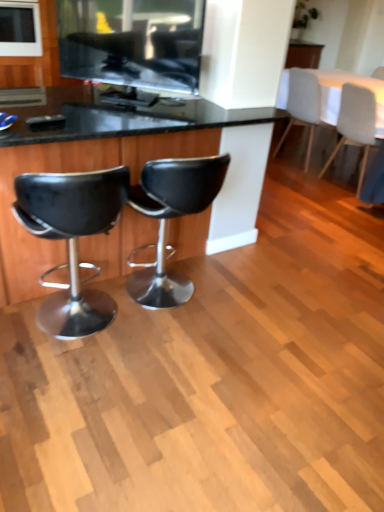
At what (x,y) coordinates should I click in order to perform the action: click on white fabric chair at upper right, the second chair positioned from the back. Please return your answer as a coordinate pair (x, y). Looking at the image, I should click on (356, 124).

Describe the element at coordinates (356, 124) in the screenshot. I see `white fabric chair at upper right, the second chair positioned from the back` at that location.

In order to face black leather desk at center, should I rotate leftwards or rightwards?

Rotate left and turn 12.458 degrees.

Where is `black leather desk at center`? The height and width of the screenshot is (512, 384). black leather desk at center is located at coordinates (95, 157).

Measure the distance between matte black tv at upper center, positioned as the 1th appliance in right-to-left order, and camera.

They are 2.06 meters apart.

This screenshot has height=512, width=384. I want to click on matte black tv at upper center, positioned as the second appliance in top-to-bottom order, so click(x=132, y=42).

What do you see at coordinates (20, 29) in the screenshot? This screenshot has width=384, height=512. I see `white glossy microwave at upper left, which appears as the first appliance when viewed from the left` at bounding box center [20, 29].

The image size is (384, 512). I want to click on white fabric chair at upper right, which is counted as the 3th chair, starting from the front, so click(x=356, y=124).

How different are the orientations of black leather stool at left, which is the 4th chair from back to front, and matte black tv at upper center, the first appliance when ordered from bottom to top, in degrees?

The angular difference between black leather stool at left, which is the 4th chair from back to front, and matte black tv at upper center, the first appliance when ordered from bottom to top, is 137 degrees.

Between black leather stool at left, which ranks as the first chair in front-to-back order, and matte black tv at upper center, the 2th appliance viewed from the left, which one has larger width?

Wider between the two is black leather stool at left, which ranks as the first chair in front-to-back order.

Which is behind, black leather stool at left, which ranks as the first chair in front-to-back order, or matte black tv at upper center, positioned as the 1th appliance in right-to-left order?

matte black tv at upper center, positioned as the 1th appliance in right-to-left order, is further from the camera.

Is black leather stool at left, which ranks as the first chair in front-to-back order, facing away from matte black tv at upper center, the 2th appliance viewed from the left?

No, black leather stool at left, which ranks as the first chair in front-to-back order,'s orientation is not away from matte black tv at upper center, the 2th appliance viewed from the left.

Does white fabric table at upper right touch black leather stool at center, marked as the 2th chair in a front-to-back arrangement?

white fabric table at upper right and black leather stool at center, marked as the 2th chair in a front-to-back arrangement, are not in contact.

From the white fabric table at upper right, count the 3rd chair to the left and point to it. Please provide its 2D coordinates.

[(172, 217)]

Based on the photo, from the image's perspective, which object appears higher, white fabric table at upper right or black leather stool at center, positioned as the 2th chair in left-to-right order?

white fabric table at upper right, from the image's perspective.

What's the angular difference between black leather stool at left, the fourth chair from the right, and white fabric table at upper right's facing directions?

The angle between the facing direction of black leather stool at left, the fourth chair from the right, and the facing direction of white fabric table at upper right is 89.3 degrees.

Considering the relative positions of black leather stool at left, which ranks as the first chair in front-to-back order, and white fabric table at upper right in the image provided, is black leather stool at left, which ranks as the first chair in front-to-back order, behind white fabric table at upper right?

No, black leather stool at left, which ranks as the first chair in front-to-back order, is in front of white fabric table at upper right.

Which object is positioned more to the left, black leather stool at left, marked as the first chair in a left-to-right arrangement, or white fabric table at upper right?

Positioned to the left is black leather stool at left, marked as the first chair in a left-to-right arrangement.

Considering the relative sizes of black leather stool at center, marked as the 2th chair in a front-to-back arrangement, and matte black tv at upper center, the first appliance when ordered from bottom to top, in the image provided, is black leather stool at center, marked as the 2th chair in a front-to-back arrangement, bigger than matte black tv at upper center, the first appliance when ordered from bottom to top,?

Correct, black leather stool at center, marked as the 2th chair in a front-to-back arrangement, is larger in size than matte black tv at upper center, the first appliance when ordered from bottom to top.

From the image's perspective, which is below, black leather stool at center, positioned as the 2th chair in left-to-right order, or matte black tv at upper center, the first appliance in the front-to-back sequence?

black leather stool at center, positioned as the 2th chair in left-to-right order.

Is black leather stool at center, positioned as the 2th chair in left-to-right order, at the right side of matte black tv at upper center, which appears as the second appliance when viewed from the back?

Yes, black leather stool at center, positioned as the 2th chair in left-to-right order, is to the right of matte black tv at upper center, which appears as the second appliance when viewed from the back.

Is black leather stool at center, positioned as the third chair in right-to-left order, oriented away from matte black tv at upper center, positioned as the 1th appliance in right-to-left order?

That's not correct — black leather stool at center, positioned as the third chair in right-to-left order, is not looking away from matte black tv at upper center, positioned as the 1th appliance in right-to-left order.

Choose the correct answer: Is white glossy microwave at upper left, the second appliance viewed from the front, inside white fabric chair at upper right, which appears as the third chair when viewed from the left, or outside it?

white glossy microwave at upper left, the second appliance viewed from the front, lies outside white fabric chair at upper right, which appears as the third chair when viewed from the left.

Which is in front, point (4, 37) or point (313, 85)?

Point (313, 85)

Is white glossy microwave at upper left, the second appliance viewed from the front, facing away from white fabric chair at upper right, the first chair from the back?

No, white glossy microwave at upper left, the second appliance viewed from the front, is not facing away from white fabric chair at upper right, the first chair from the back.

Considering the positions of objects white glossy microwave at upper left, the second appliance from the right, and white fabric chair at upper right, which appears as the third chair when viewed from the left, in the image provided, who is more to the right, white glossy microwave at upper left, the second appliance from the right, or white fabric chair at upper right, which appears as the third chair when viewed from the left,?

From the viewer's perspective, white fabric chair at upper right, which appears as the third chair when viewed from the left, appears more on the right side.

Could you tell me if black leather desk at center is facing white fabric chair at upper right, the second chair positioned from the back?

No.

Could you measure the distance between black leather desk at center and white fabric chair at upper right, which is counted as the 3th chair, starting from the front?

black leather desk at center is 6.19 feet away from white fabric chair at upper right, which is counted as the 3th chair, starting from the front.

Based on the photo, who is shorter, black leather desk at center or white fabric chair at upper right, the second chair positioned from the back?

white fabric chair at upper right, the second chair positioned from the back.

Which of these two, black leather desk at center or white fabric chair at upper right, the second chair positioned from the back, is wider?

With larger width is black leather desk at center.

Choose the correct answer: Is white fabric chair at upper right, which appears as the 1th chair when viewed from the right, inside black leather stool at center, positioned as the third chair in right-to-left order, or outside it?

white fabric chair at upper right, which appears as the 1th chair when viewed from the right, exists outside the volume of black leather stool at center, positioned as the third chair in right-to-left order.

Who is smaller, white fabric chair at upper right, the second chair positioned from the back, or black leather stool at center, which ranks as the 3th chair in back-to-front order?

black leather stool at center, which ranks as the 3th chair in back-to-front order.

From a real-world perspective, between white fabric chair at upper right, the fourth chair positioned from the left, and black leather stool at center, positioned as the third chair in right-to-left order, who is vertically higher?

In real-world perspective, white fabric chair at upper right, the fourth chair positioned from the left, is above.

There is a matte black tv at upper center, positioned as the second appliance in top-to-bottom order. Find the location of `the 3rd chair below it (from the image's perspective)`. the 3rd chair below it (from the image's perspective) is located at coordinates (72, 240).

Where is `table behind the black leather stool at center, which ranks as the 3th chair in back-to-front order`? The image size is (384, 512). table behind the black leather stool at center, which ranks as the 3th chair in back-to-front order is located at coordinates (340, 94).

Which object lies further to the anchor point matte black tv at upper center, the 2th appliance viewed from the left, black leather stool at center, which ranks as the 3th chair in back-to-front order, or black leather stool at left, the fourth chair from the right?

black leather stool at left, the fourth chair from the right, is positioned further to the anchor matte black tv at upper center, the 2th appliance viewed from the left.

Estimate the real-world distances between objects in this image. Which object is further from black leather desk at center, white glossy microwave at upper left, placed as the first appliance when sorted from top to bottom, or white fabric table at upper right?

white glossy microwave at upper left, placed as the first appliance when sorted from top to bottom, is further to black leather desk at center.

Looking at the image, which one is located further to matte black tv at upper center, the first appliance when ordered from bottom to top, white fabric table at upper right or black leather stool at center, positioned as the 2th chair in left-to-right order?

white fabric table at upper right.

Considering their positions, is white fabric table at upper right positioned closer to white fabric chair at upper right, which is counted as the 3th chair, starting from the front, than black leather stool at center, which ranks as the 3th chair in back-to-front order?

white fabric table at upper right.

From the image, which object appears to be farther from white glossy microwave at upper left, the 2th appliance ordered from the bottom, black leather stool at left, the fourth chair from the right, or black leather desk at center?

Based on the image, black leather stool at left, the fourth chair from the right, appears to be further to white glossy microwave at upper left, the 2th appliance ordered from the bottom.

Based on their spatial positions, is black leather stool at left, the fourth chair from the right, or black leather stool at center, which ranks as the 3th chair in back-to-front order, closer to matte black tv at upper center, positioned as the 1th appliance in right-to-left order?

Based on the image, black leather stool at center, which ranks as the 3th chair in back-to-front order, appears to be nearer to matte black tv at upper center, positioned as the 1th appliance in right-to-left order.

Considering their positions, is black leather stool at left, which ranks as the first chair in front-to-back order, positioned further to black leather stool at center, positioned as the 2th chair in left-to-right order, than white fabric chair at upper right, which appears as the 1th chair when viewed from the right?

white fabric chair at upper right, which appears as the 1th chair when viewed from the right.

Consider the image. Based on their spatial positions, is white fabric chair at upper right, the first chair from the back, or matte black tv at upper center, positioned as the 1th appliance in right-to-left order, closer to black leather stool at center, positioned as the third chair in right-to-left order?

matte black tv at upper center, positioned as the 1th appliance in right-to-left order.

The height and width of the screenshot is (512, 384). I want to click on chair between white fabric table at upper right and white fabric chair at upper right, which is counted as the 3th chair, starting from the front, in the up-down direction, so click(303, 106).

Find the location of `desk positioned between black leather stool at left, which is the 4th chair from back to front, and white fabric chair at upper right, which appears as the third chair when viewed from the left, from near to far`. desk positioned between black leather stool at left, which is the 4th chair from back to front, and white fabric chair at upper right, which appears as the third chair when viewed from the left, from near to far is located at coordinates (95, 157).

The height and width of the screenshot is (512, 384). Identify the location of appliance between black leather desk at center and white fabric chair at upper right, arranged as the second chair when viewed from the right, along the z-axis. (132, 42).

The image size is (384, 512). I want to click on appliance located between white glossy microwave at upper left, the 1th appliance viewed from the back, and white fabric table at upper right in the left-right direction, so click(132, 42).